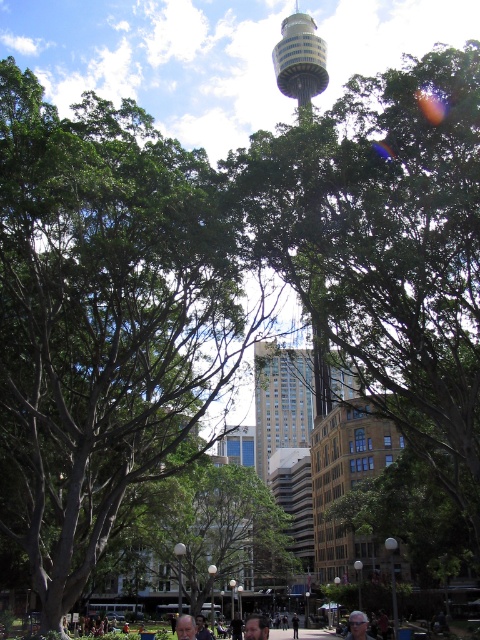
Does green leafy tree at center have a larger size compared to matte black hair at center?

Yes.

The height and width of the screenshot is (640, 480). Identify the location of green leafy tree at center. click(x=387, y=248).

Is point (448, 237) farther from viewer compared to point (252, 636)?

No, (448, 237) is in front of (252, 636).

Find the location of a particular element. Image resolution: width=480 pixels, height=640 pixels. green leafy tree at center is located at coordinates (387, 248).

Between green leafy tree at center and gray hair at center, which one is positioned lower?

gray hair at center

Which of these two, green leafy tree at center or gray hair at center, stands shorter?

gray hair at center

Identify the location of green leafy tree at center. This screenshot has width=480, height=640. (387, 248).